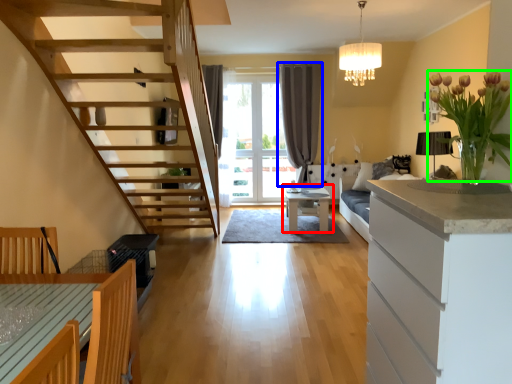
Question: Based on their relative distances, which object is farther from table (highlighted by a red box)? Choose from curtain (highlighted by a blue box) and flower (highlighted by a green box).

Choices:
 (A) curtain
 (B) flower

Answer: (B)